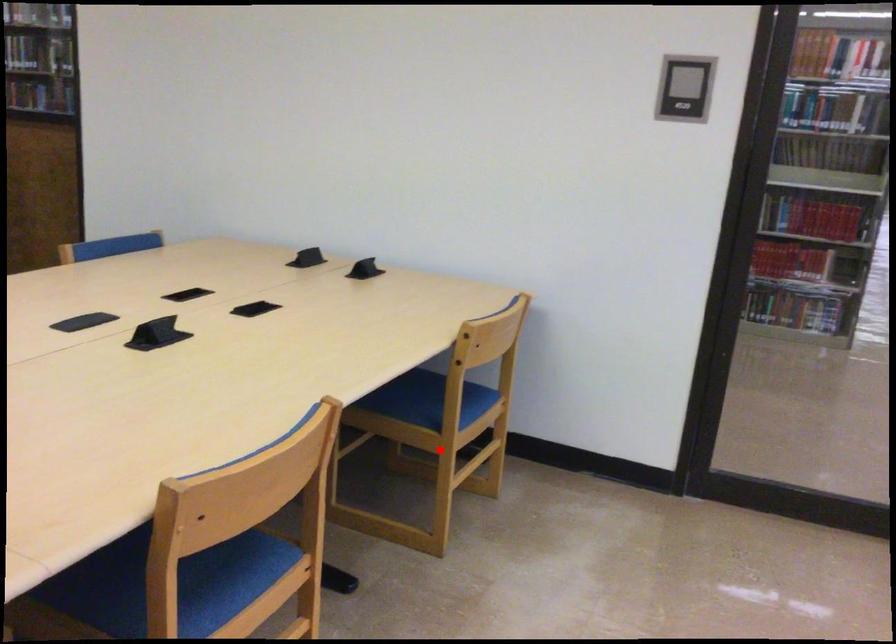
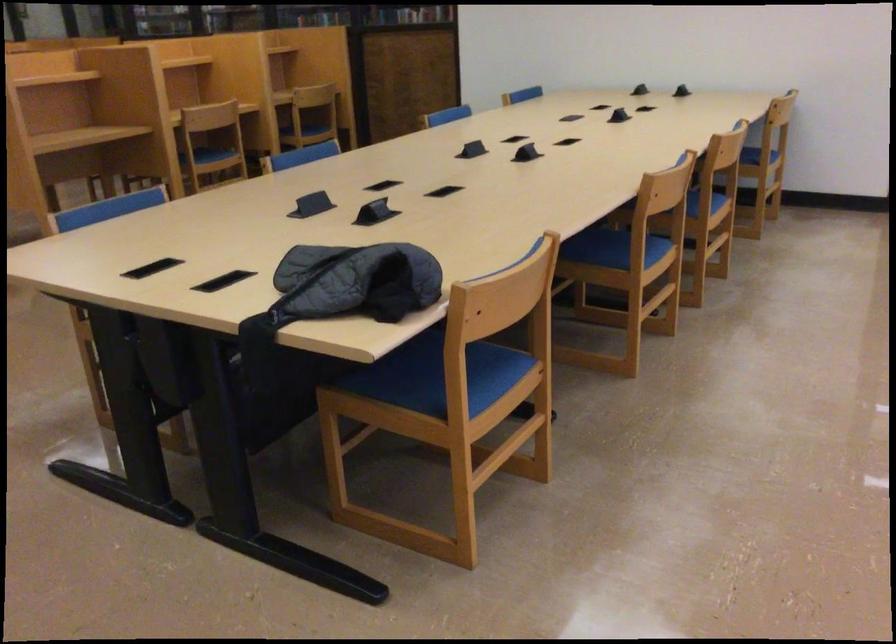
Question: I am providing you with two images of the same scene from different viewpoints. In image1, a red point is highlighted. Considering the same 3D point in image2, which of the following is correct?

Choices:
 (A) It is closer
 (B) It is farther

Answer: (B)